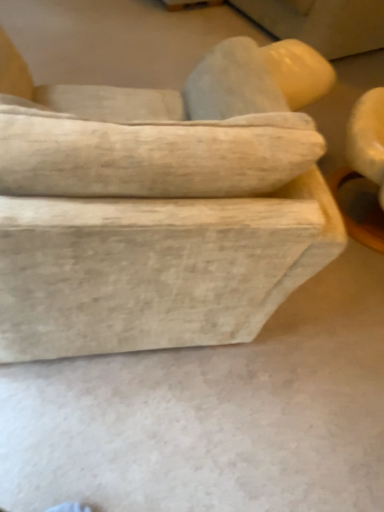
The height and width of the screenshot is (512, 384). In order to click on light beige fabric couch at center in this screenshot , I will do `click(160, 207)`.

This screenshot has width=384, height=512. What do you see at coordinates (160, 207) in the screenshot?
I see `light beige fabric couch at center` at bounding box center [160, 207].

The image size is (384, 512). Find the location of `light beige fabric couch at center`. light beige fabric couch at center is located at coordinates (160, 207).